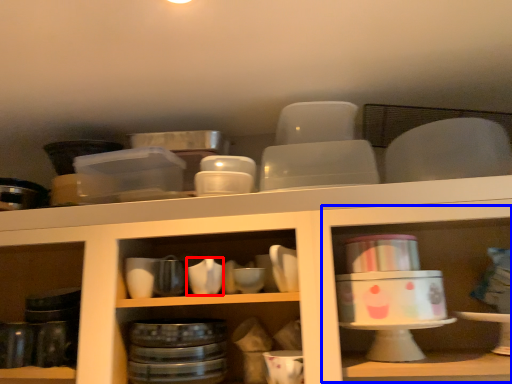
Question: Which object is closer to the camera taking this photo, tableware (highlighted by a red box) or shelf (highlighted by a blue box)?

Choices:
 (A) tableware
 (B) shelf

Answer: (B)